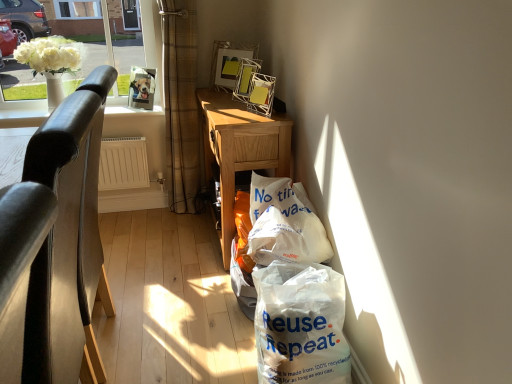
Identify the location of free region under brown plaid curtain at upper left (from a real-world perspective). (180, 214).